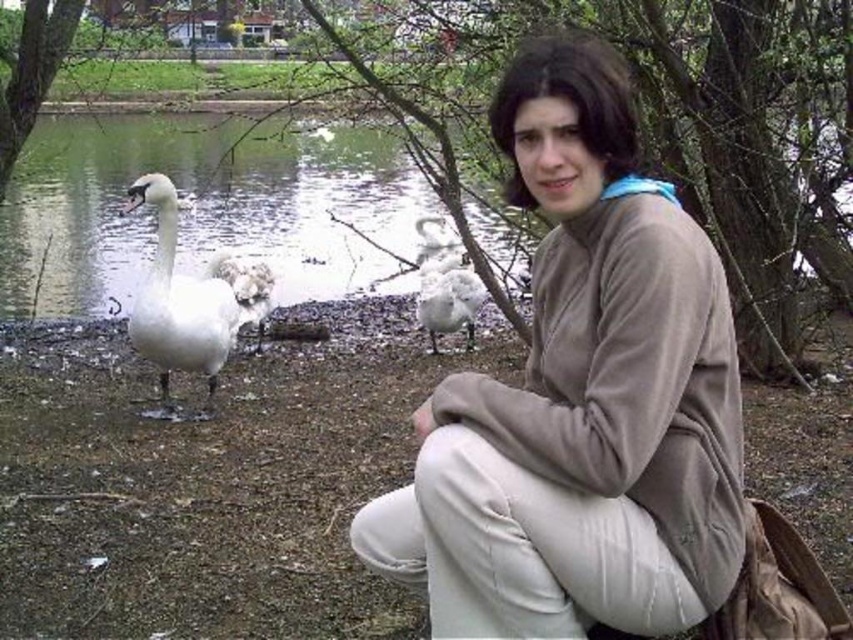
Question: From the image, what is the correct spatial relationship of white matte pants at lower center in relation to white fluffy goose at left?

Choices:
 (A) right
 (B) left

Answer: (A)

Question: Does white glossy water at left have a lesser width compared to white fluffy goose at left?

Choices:
 (A) no
 (B) yes

Answer: (A)

Question: Which object is farther from the camera taking this photo?

Choices:
 (A) matte brown sweater at center
 (B) white fluffy goose at center

Answer: (B)

Question: Can you confirm if matte brown sweater at center is positioned to the left of white fluffy goose at left?

Choices:
 (A) yes
 (B) no

Answer: (B)

Question: Which is nearer to the white glossy swan at left?

Choices:
 (A) white fluffy goose at left
 (B) matte brown sweater at center
 (C) white glossy water at left
 (D) white fluffy goose at center

Answer: (A)

Question: Which point is closer to the camera?

Choices:
 (A) (224, 289)
 (B) (468, 278)

Answer: (A)